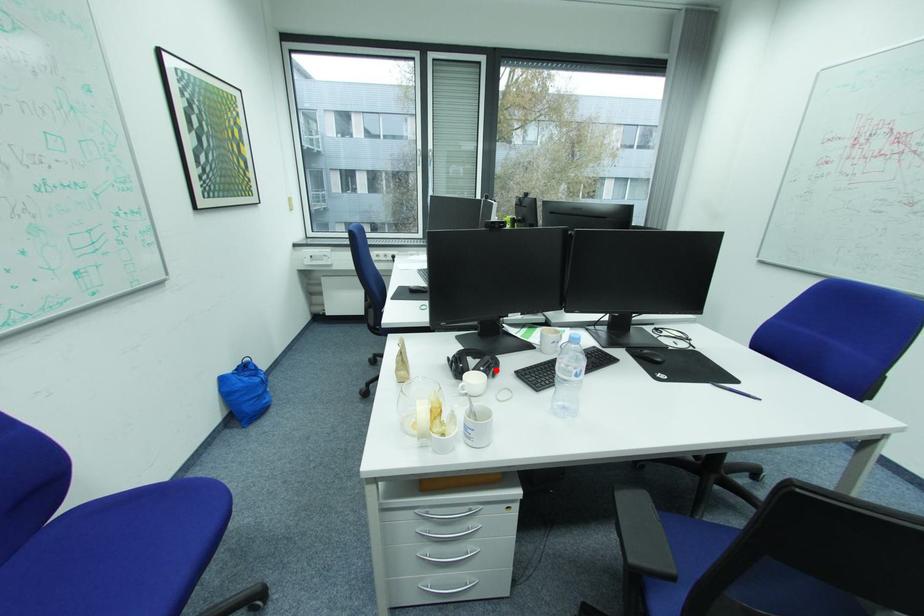
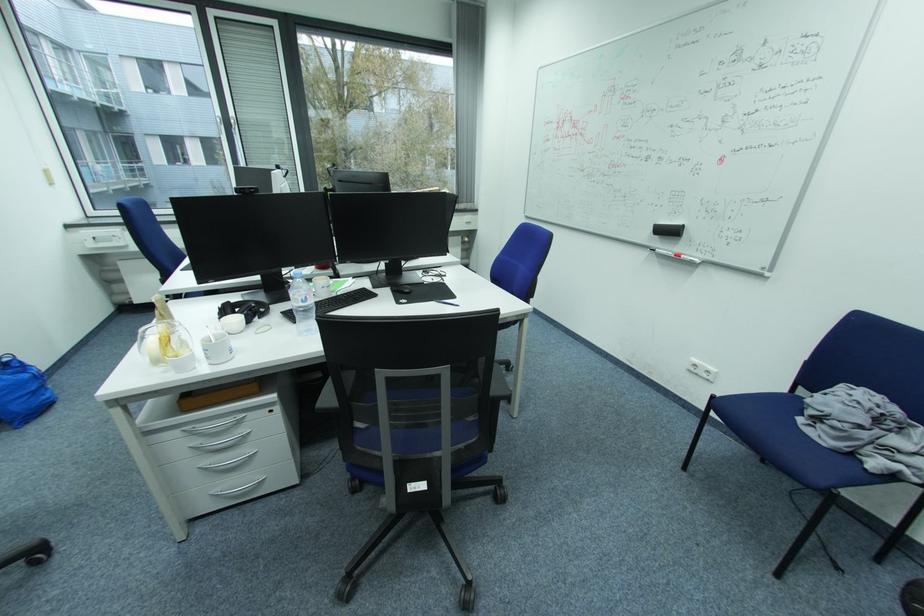
Find the pixel in the second image that matches the highlighted location in the first image.

(259, 313)